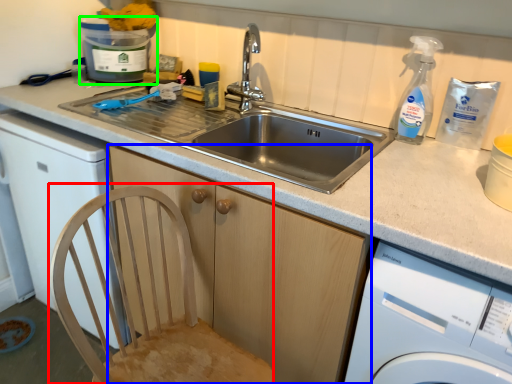
Question: Based on their relative distances, which object is nearer to feeding chair (highlighted by a red box)? Choose from cabinetry (highlighted by a blue box) and water cooler (highlighted by a green box).

Choices:
 (A) cabinetry
 (B) water cooler

Answer: (A)